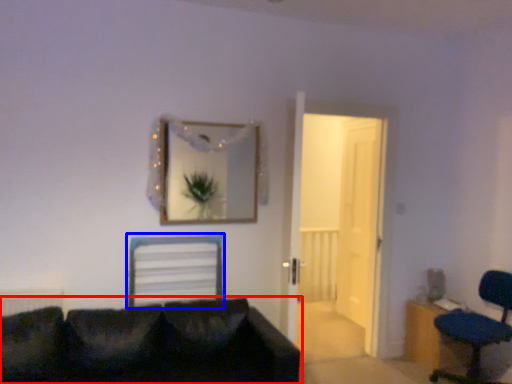
Question: Which point is further to the camera, studio couch (highlighted by a red box) or computer chair (highlighted by a blue box)?

Choices:
 (A) studio couch
 (B) computer chair

Answer: (B)